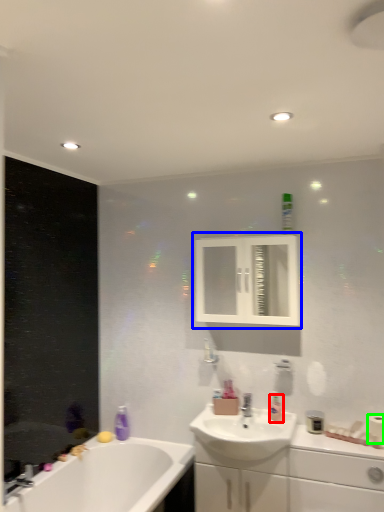
Question: Considering the real-world distances, which object is farthest from toiletry (highlighted by a red box)? medicine cabinet (highlighted by a blue box) or toilet paper (highlighted by a green box)?

Choices:
 (A) medicine cabinet
 (B) toilet paper

Answer: (A)